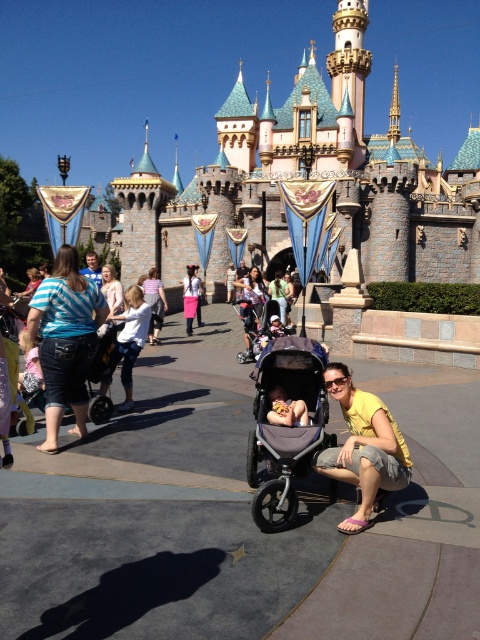
In the Disneyland scene, there is a pink stone castle at center and a matte pink shirt at center. From the perspective of someone facing the scene, which object is positioned to the right of the other?

The pink stone castle at center is to the right of the matte pink shirt at center.

You are standing at the entrance of Disneyland and see the gray fabric stroller at center and the Sleeping Beauty Castle in the background. How far apart are these two landmarks from each other?

The gray fabric stroller at center and the Sleeping Beauty Castle are 140.45 feet apart.

You are standing in front of the Sleeping Beauty Castle at Disneyland and want to take a photo of the two points marked in the image. Which point, point [302,371] or point [250,323], is closer to you?

Point [302,371] is closer to the camera than point [250,323], so it is closer to you.